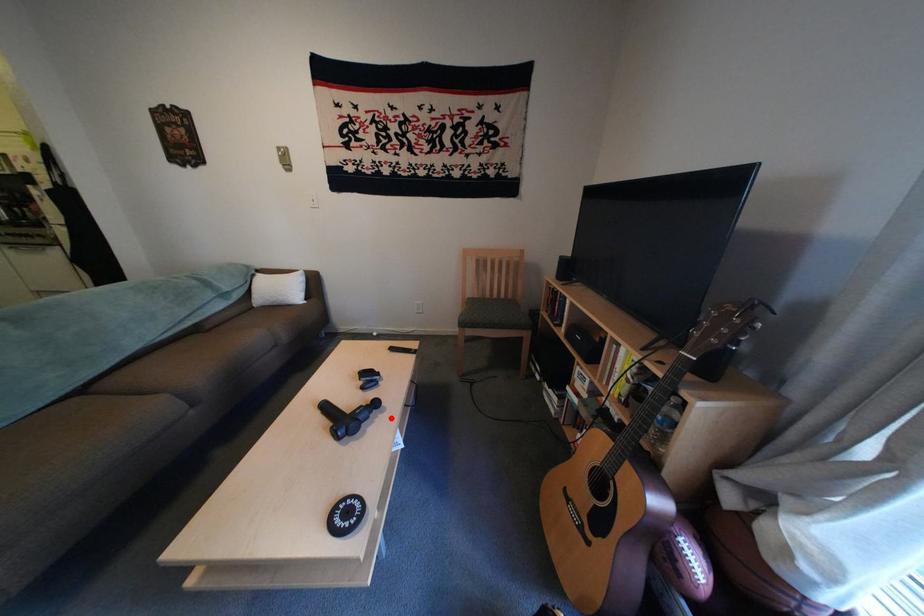
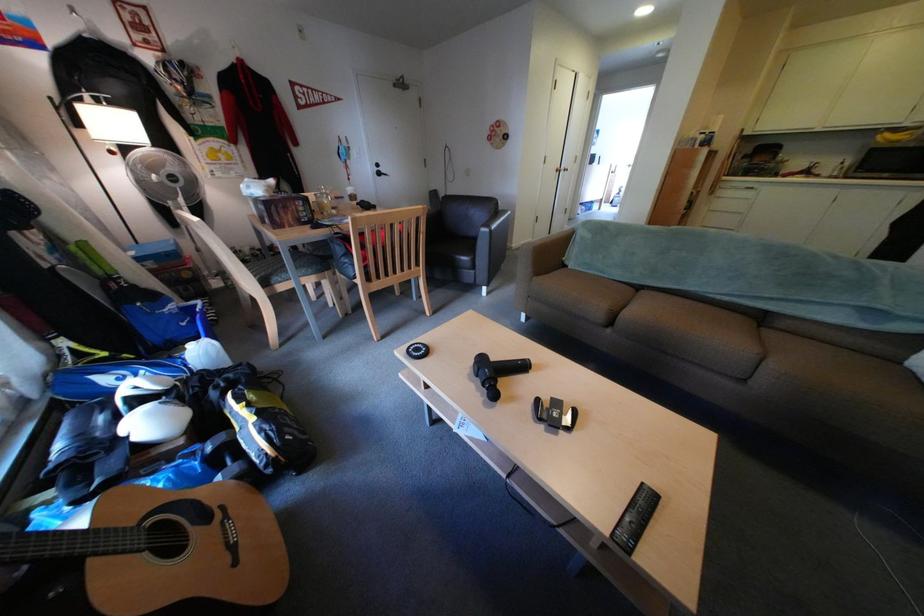
Locate, in the second image, the point that corresponds to the highlighted location in the first image.

(496, 397)